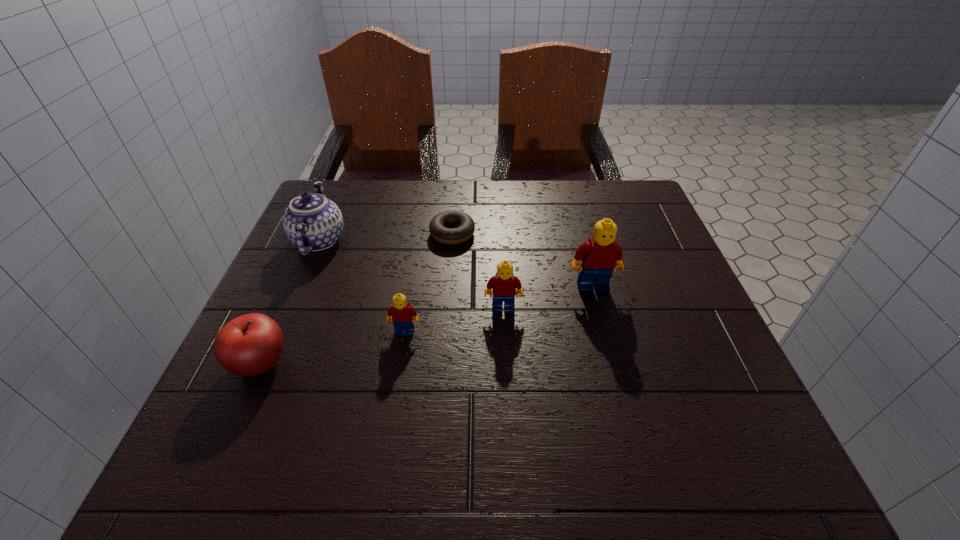
I want to click on the leftmost Lego, so click(400, 314).

Find the location of `the fifth farthest object`. the fifth farthest object is located at coordinates (400, 314).

Locate an element on the screen. the fourth farthest object is located at coordinates (504, 285).

Locate an element on the screen. Image resolution: width=960 pixels, height=540 pixels. the fifth object from left to right is located at coordinates point(504,285).

Find the location of a particular element. The width and height of the screenshot is (960, 540). the farthest Lego is located at coordinates (601, 255).

The image size is (960, 540). I want to click on the tallest Lego, so click(601, 255).

This screenshot has width=960, height=540. Find the location of `chinaware`. chinaware is located at coordinates (312, 222).

In order to click on the nearest object in this screenshot , I will do `click(251, 344)`.

Locate an element on the screen. The height and width of the screenshot is (540, 960). doughnut is located at coordinates (465, 225).

Locate an element on the screen. The width and height of the screenshot is (960, 540). vacant region located 0.110m on the front-facing side of the shortest Lego is located at coordinates (396, 384).